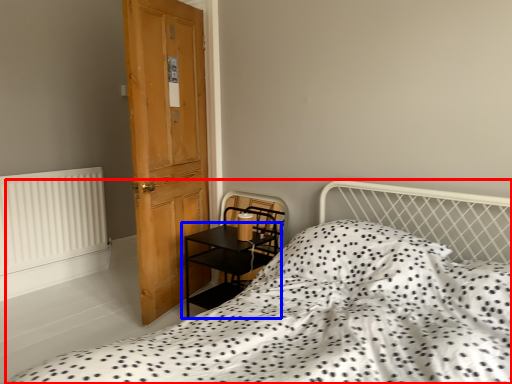
Question: Among these objects, which one is nearest to the camera, bed (highlighted by a red box) or table (highlighted by a blue box)?

Choices:
 (A) bed
 (B) table

Answer: (A)